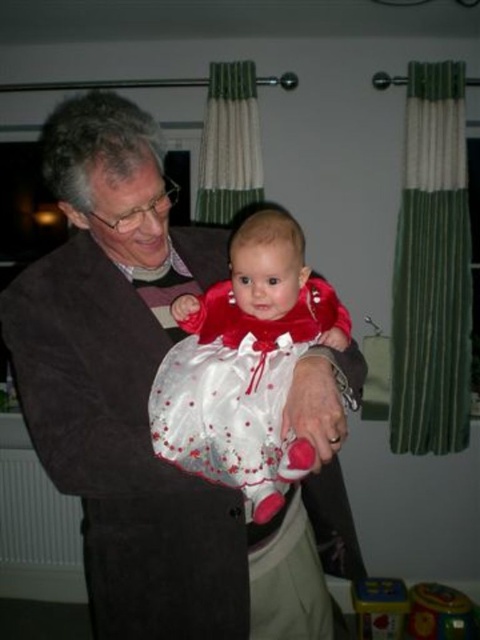
Is smooth plastic toy at lower right wider than multicolored plastic toy at lower right?

Correct, the width of smooth plastic toy at lower right exceeds that of multicolored plastic toy at lower right.

Locate an element on the screen. The height and width of the screenshot is (640, 480). smooth plastic toy at lower right is located at coordinates (440, 612).

Between suede jacket at center and multicolored plastic toy at lower right, which one appears on the left side from the viewer's perspective?

suede jacket at center is more to the left.

Who is more distant from viewer, (x=247, y=534) or (x=359, y=616)?

The point (x=359, y=616) is behind.

The height and width of the screenshot is (640, 480). I want to click on suede jacket at center, so click(145, 406).

Between point (71, 204) and point (465, 630), which one is positioned behind?

Point (465, 630)

Which of these two, suede jacket at center or smooth plastic toy at lower right, stands taller?

suede jacket at center is taller.

What do you see at coordinates (145, 406) in the screenshot? The image size is (480, 640). I see `suede jacket at center` at bounding box center [145, 406].

Where is `suede jacket at center`? suede jacket at center is located at coordinates (145, 406).